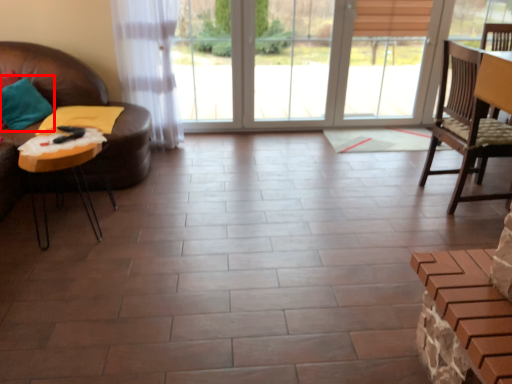
Question: In this image, where is pillow (annotated by the red box) located relative to table?

Choices:
 (A) right
 (B) left

Answer: (B)